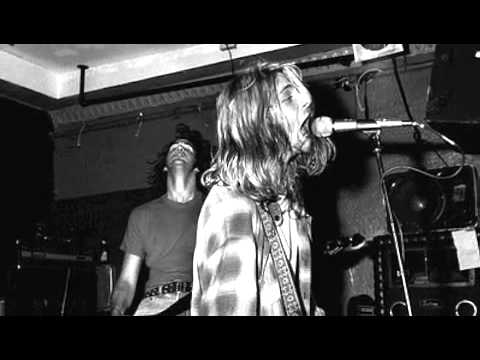
Locate an element on the screen. The image size is (480, 360). ceiling is located at coordinates click(x=60, y=50).